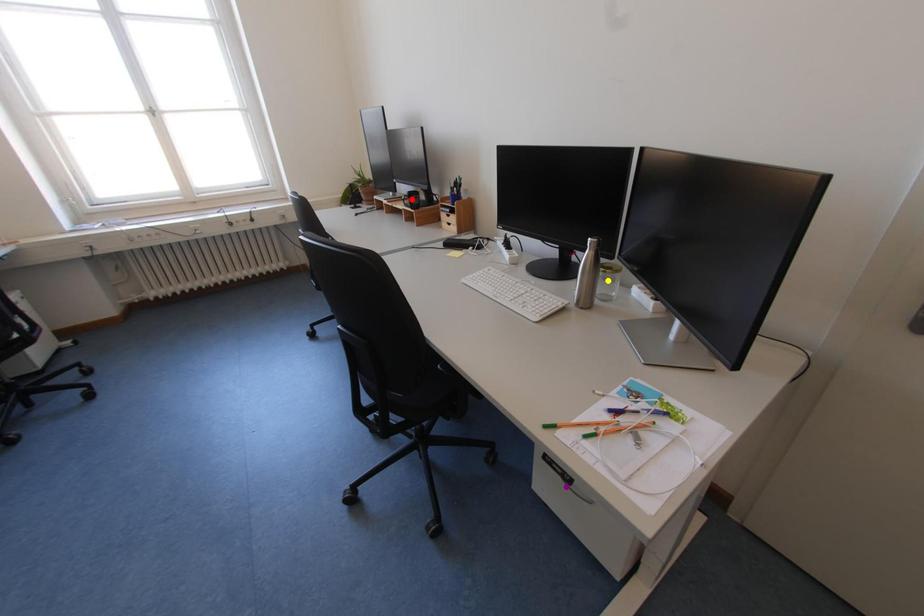
Order these from nearest to farthest:
1. purple point
2. yellow point
3. red point

red point → yellow point → purple point